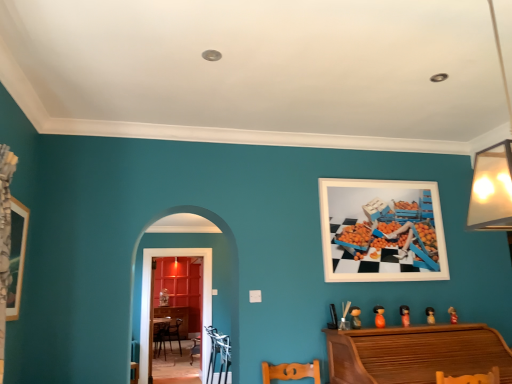
Locate an element on the screen. The width and height of the screenshot is (512, 384). vacant area that is situated to the right of orange matte toy at lower right, the 2th toy viewed from the left is located at coordinates (400, 327).